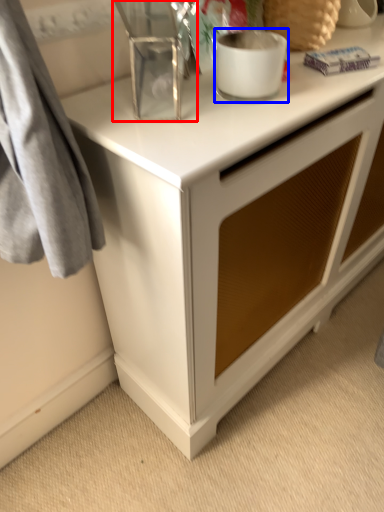
Question: Which point is closer to the camera, appliance (highlighted by a red box) or appliance (highlighted by a blue box)?

Choices:
 (A) appliance
 (B) appliance

Answer: (A)